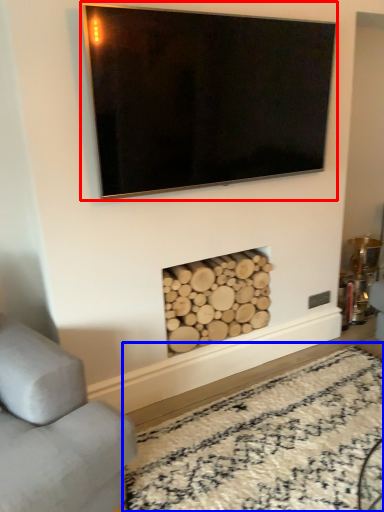
Question: Which object is closer to the camera taking this photo, television (highlighted by a red box) or plain (highlighted by a blue box)?

Choices:
 (A) television
 (B) plain

Answer: (B)